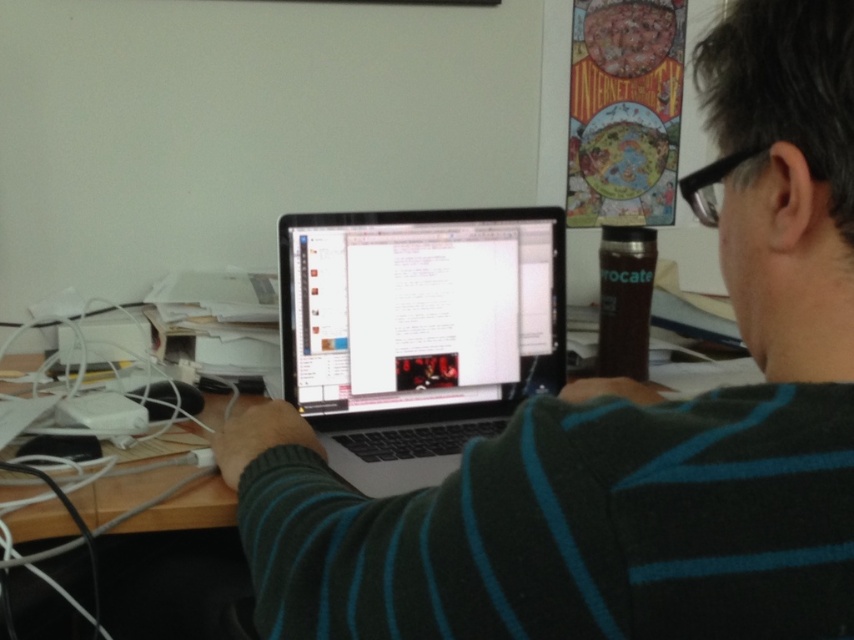
Is point (551, 358) more distant than point (27, 528)?

Yes, point (551, 358) is farther from viewer.

Who is shorter, sleek silver laptop at center or wooden at center?

wooden at center is shorter.

Locate an element on the screen. The height and width of the screenshot is (640, 854). sleek silver laptop at center is located at coordinates (417, 332).

Can you confirm if black matte laptop at center is shorter than wooden at center?

Incorrect, black matte laptop at center's height does not fall short of wooden at center's.

Can you confirm if black matte laptop at center is positioned below wooden at center?

Incorrect, black matte laptop at center is not positioned below wooden at center.

Is point (633, 624) positioned in front of point (121, 502)?

Yes, it is.

Image resolution: width=854 pixels, height=640 pixels. I want to click on black matte laptop at center, so click(626, 428).

Can you confirm if black matte laptop at center is bigger than sleek silver laptop at center?

Yes.

Does black matte laptop at center have a lesser width compared to sleek silver laptop at center?

In fact, black matte laptop at center might be wider than sleek silver laptop at center.

Does point (797, 634) come behind point (407, 380)?

No, (797, 634) is closer to viewer.

At what (x,y) coordinates should I click in order to perform the action: click on black matte laptop at center. Please return your answer as a coordinate pair (x, y). Looking at the image, I should click on (626, 428).